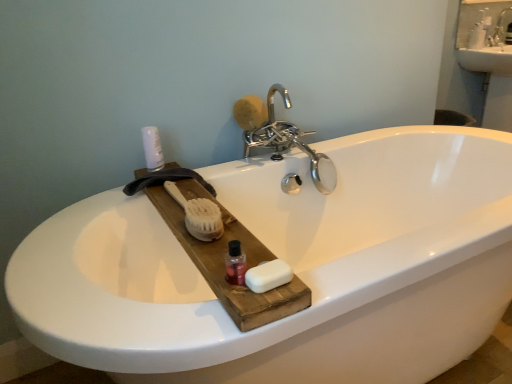
What do you see at coordinates (152, 148) in the screenshot?
I see `white matte spray can at upper left` at bounding box center [152, 148].

This screenshot has height=384, width=512. What do you see at coordinates (250, 112) in the screenshot?
I see `yellow sponge at upper center, acting as the first soap starting from the back` at bounding box center [250, 112].

Measure the distance between point (192, 234) and camera.

A distance of 35.47 inches exists between point (192, 234) and camera.

I want to click on chrome metallic faucet at upper center, so click(280, 135).

Locate an element on the screen. This screenshot has width=512, height=384. white matte spray can at upper left is located at coordinates (152, 148).

Does translucent plastic bottle at center lie in front of yellow sponge at upper center, acting as the first soap starting from the back?

Yes, the depth of translucent plastic bottle at center is less than that of yellow sponge at upper center, acting as the first soap starting from the back.

Is translucent plastic bottle at center to the left of yellow sponge at upper center, the 2th soap in the front-to-back sequence, from the viewer's perspective?

Indeed, translucent plastic bottle at center is positioned on the left side of yellow sponge at upper center, the 2th soap in the front-to-back sequence.

From the picture: Is translucent plastic bottle at center taller than yellow sponge at upper center, marked as the second soap in a bottom-to-top arrangement?

In fact, translucent plastic bottle at center may be shorter than yellow sponge at upper center, marked as the second soap in a bottom-to-top arrangement.

Is point (233, 284) more distant than point (256, 96)?

No, (233, 284) is in front of (256, 96).

From the image's perspective, between translucent plastic bottle at center and white matte soap at center, the second soap when ordered from top to bottom, who is located below?

white matte soap at center, the second soap when ordered from top to bottom, from the image's perspective.

At what (x,y) coordinates should I click in order to perform the action: click on mouthwash lying above the white matte soap at center, the second soap when ordered from top to bottom (from the image's perspective). Please return your answer as a coordinate pair (x, y). The width and height of the screenshot is (512, 384). Looking at the image, I should click on (234, 264).

Consider the image. Is white matte soap at center, the second soap from the back, at the back of translucent plastic bottle at center?

translucent plastic bottle at center does not have its back to white matte soap at center, the second soap from the back.

Is the surface of translucent plastic bottle at center in direct contact with white matte soap at center, the second soap from the back?

Yes, translucent plastic bottle at center is touching white matte soap at center, the second soap from the back.

Considering the sizes of objects white natural wood brush at center and chrome metallic faucet at upper center in the image provided, who is wider, white natural wood brush at center or chrome metallic faucet at upper center?

white natural wood brush at center.

Considering the relative sizes of white natural wood brush at center and chrome metallic faucet at upper center in the image provided, is white natural wood brush at center bigger than chrome metallic faucet at upper center?

Actually, white natural wood brush at center might be smaller than chrome metallic faucet at upper center.

Image resolution: width=512 pixels, height=384 pixels. What are the coordinates of `brush below the chrome metallic faucet at upper center (from the image's perspective)` in the screenshot? It's located at (198, 215).

Would you say white natural wood brush at center is a long distance from chrome metallic faucet at upper center?

No, white natural wood brush at center is not far away from chrome metallic faucet at upper center.

Is point (252, 101) behind point (155, 144)?

Yes, point (252, 101) is behind point (155, 144).

From the image's perspective, which one is positioned lower, chrome metallic faucet at upper center or white matte spray can at upper left?

From the image's view, white matte spray can at upper left is below.

Is chrome metallic faucet at upper center shorter than white matte spray can at upper left?

In fact, chrome metallic faucet at upper center may be taller than white matte spray can at upper left.

Does point (240, 273) appear closer or farther from the camera than point (159, 164)?

Point (240, 273) is positioned closer to the camera compared to point (159, 164).

In the scene shown: Which object is wider, translucent plastic bottle at center or white matte spray can at upper left?

Wider between the two is white matte spray can at upper left.

Could you tell me if translucent plastic bottle at center is facing white matte spray can at upper left?

No.

Is white matte spray can at upper left a part of translucent plastic bottle at center?

Actually, white matte spray can at upper left is outside translucent plastic bottle at center.

Is yellow sponge at upper center, marked as the second soap in a bottom-to-top arrangement, not near white natural wood brush at center?

Actually, yellow sponge at upper center, marked as the second soap in a bottom-to-top arrangement, and white natural wood brush at center are a little close together.

Is yellow sponge at upper center, acting as the first soap starting from the back, closer to camera compared to white natural wood brush at center?

No, yellow sponge at upper center, acting as the first soap starting from the back, is behind white natural wood brush at center.

From a real-world perspective, relative to white natural wood brush at center, is yellow sponge at upper center, marked as the second soap in a bottom-to-top arrangement, vertically above or below?

yellow sponge at upper center, marked as the second soap in a bottom-to-top arrangement, is situated higher than white natural wood brush at center in the real world.

Is white natural wood brush at center at the back of yellow sponge at upper center, acting as the first soap starting from the back?

No, yellow sponge at upper center, acting as the first soap starting from the back, is not facing away from white natural wood brush at center.

Is white matte soap at center, the second soap when ordered from top to bottom, looking in the opposite direction of chrome metallic faucet at upper center?

white matte soap at center, the second soap when ordered from top to bottom, does not have its back to chrome metallic faucet at upper center.

Can you confirm if white matte soap at center, the second soap when ordered from top to bottom, is taller than chrome metallic faucet at upper center?

No.

From the image's perspective, relative to chrome metallic faucet at upper center, is white matte soap at center, the second soap from the back, above or below?

Clearly, from the image's perspective, white matte soap at center, the second soap from the back, is below chrome metallic faucet at upper center.

From a real-world perspective, who is located higher, white matte soap at center, the second soap when ordered from top to bottom, or chrome metallic faucet at upper center?

From a 3D spatial view, white matte soap at center, the second soap when ordered from top to bottom, is above.

There is a translucent plastic bottle at center. Where is `soap above it (from a real-world perspective)`? soap above it (from a real-world perspective) is located at coordinates (250, 112).

Image resolution: width=512 pixels, height=384 pixels. What are the coordinates of `soap below the translucent plastic bottle at center (from the image's perspective)` in the screenshot? It's located at (268, 276).

Which object lies further to the anchor point translucent plastic bottle at center, yellow sponge at upper center, acting as the first soap starting from the back, or white matte soap at center, the second soap when ordered from top to bottom?

yellow sponge at upper center, acting as the first soap starting from the back.

Looking at the image, which one is located further to white natural wood brush at center, white matte spray can at upper left or yellow sponge at upper center, which ranks as the 1th soap in top-to-bottom order?

yellow sponge at upper center, which ranks as the 1th soap in top-to-bottom order, lies further to white natural wood brush at center than the other object.

From the image, which object appears to be farther from white matte soap at center, the second soap when ordered from top to bottom, white natural wood brush at center or chrome metallic faucet at upper center?

chrome metallic faucet at upper center.

Estimate the real-world distances between objects in this image. Which object is closer to chrome metallic faucet at upper center, white matte spray can at upper left or yellow sponge at upper center, the 2th soap in the front-to-back sequence?

The object closer to chrome metallic faucet at upper center is yellow sponge at upper center, the 2th soap in the front-to-back sequence.

Considering their positions, is white natural wood brush at center positioned further to chrome metallic faucet at upper center than translucent plastic bottle at center?

Based on the image, translucent plastic bottle at center appears to be further to chrome metallic faucet at upper center.

From the image, which object appears to be farther from white matte soap at center, the second soap when ordered from top to bottom, yellow sponge at upper center, marked as the second soap in a bottom-to-top arrangement, or white natural wood brush at center?

Among the two, yellow sponge at upper center, marked as the second soap in a bottom-to-top arrangement, is located further to white matte soap at center, the second soap when ordered from top to bottom.

Based on the photo, from the image, which object appears to be farther from chrome metallic faucet at upper center, yellow sponge at upper center, the 2th soap in the front-to-back sequence, or white matte soap at center, the second soap when ordered from top to bottom?

white matte soap at center, the second soap when ordered from top to bottom, is positioned further to the anchor chrome metallic faucet at upper center.

Based on the photo, looking at the image, which one is located further to translucent plastic bottle at center, chrome metallic faucet at upper center or yellow sponge at upper center, marked as the second soap in a bottom-to-top arrangement?

yellow sponge at upper center, marked as the second soap in a bottom-to-top arrangement, lies further to translucent plastic bottle at center than the other object.

I want to click on mouthwash located between white matte soap at center, the second soap when ordered from top to bottom, and yellow sponge at upper center, the 2th soap in the front-to-back sequence, in the depth direction, so coord(234,264).

The width and height of the screenshot is (512, 384). Identify the location of toiletry positioned between white matte soap at center, positioned as the first soap in front-to-back order, and chrome metallic faucet at upper center from near to far. (152, 148).

This screenshot has width=512, height=384. What are the coordinates of `brush between white matte spray can at upper left and chrome metallic faucet at upper center from left to right` in the screenshot? It's located at (198, 215).

In order to click on tap positioned between white matte soap at center, positioned as the first soap in front-to-back order, and yellow sponge at upper center, acting as the first soap starting from the back, from near to far in this screenshot , I will do `click(280, 135)`.